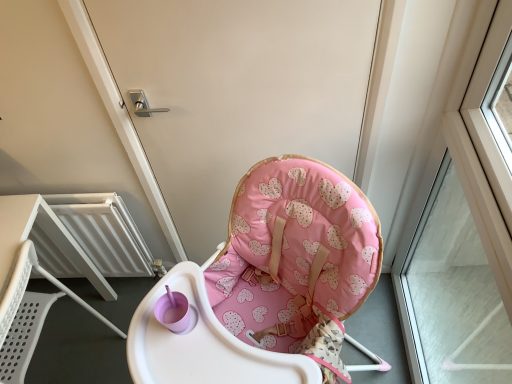
Find the location of a particular element. free space above white metallic radiator at left (from a real-world perspective) is located at coordinates (36, 200).